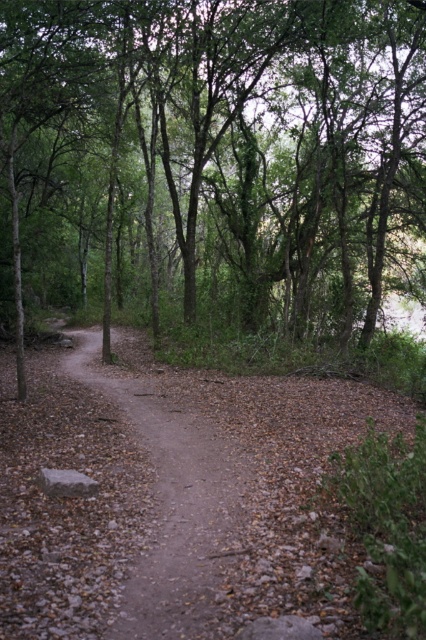
Question: Estimate the real-world distances between objects in this image. Which object is farther from the dusty brown dirt track at center?

Choices:
 (A) dirt path at center
 (B) green leafy tree at center

Answer: (B)

Question: Which of the following is the farthest from the observer?

Choices:
 (A) (81, 380)
 (B) (279, 134)

Answer: (B)

Question: Is dusty brown dirt track at center closer to the viewer compared to dirt path at center?

Choices:
 (A) yes
 (B) no

Answer: (A)

Question: Is dusty brown dirt track at center further to the viewer compared to dirt path at center?

Choices:
 (A) yes
 (B) no

Answer: (B)

Question: Is the position of green leafy tree at center less distant than that of dirt path at center?

Choices:
 (A) yes
 (B) no

Answer: (B)

Question: Estimate the real-world distances between objects in this image. Which object is closer to the dusty brown dirt track at center?

Choices:
 (A) green leafy tree at center
 (B) dirt path at center

Answer: (B)